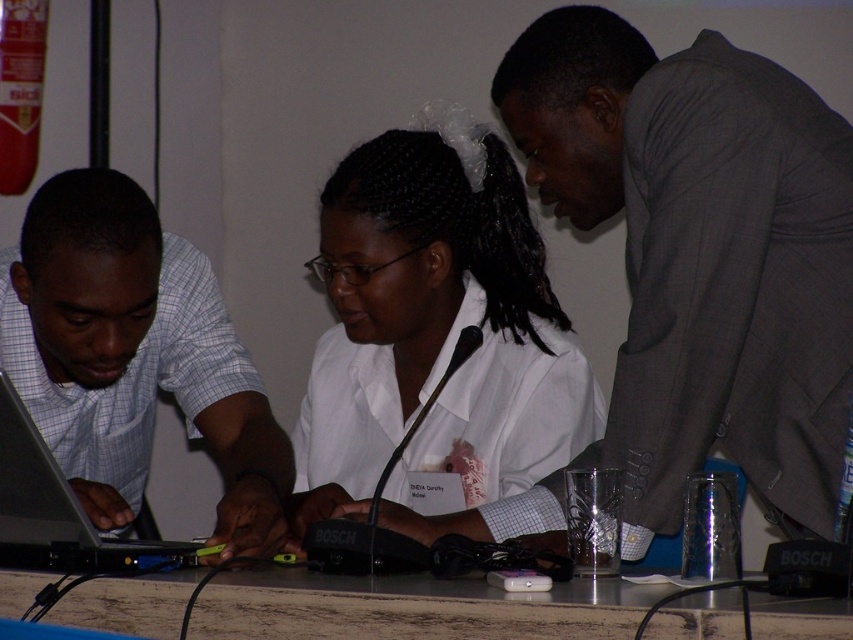
You are a photographer trying to capture a candid shot of the white matte shirt at center and the light blue checkered shirt at left. The camera you are using has a maximum focus range of 12 inches. Can you fit both subjects into the frame without moving the camera?

The white matte shirt at center and light blue checkered shirt at left are 11.33 inches apart from each other, which is within the camera maximum focus range of 12 inches. Therefore, you can fit both subjects into the frame without moving the camera.